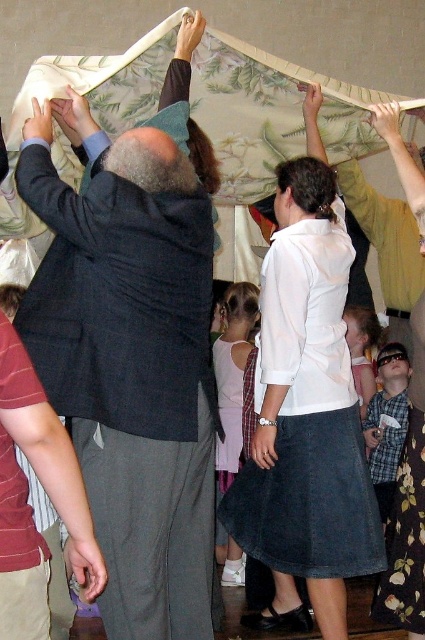
You are a photographer at the event and need to capture a photo of both the white cotton dress at center and the plaid shirt at center. Which one should you focus on first if you want to include both in the frame without moving the camera?

The white cotton dress at center is positioned on the left side of the plaid shirt at center, so you should focus on the white cotton dress at center first to ensure both are included in the frame without moving the camera.

You are standing at the point with coordinates point [224,417] and want to walk to the point with coordinates point [365,417]. Which direction should you move in?

You should move backward because point [224,417] is in front of point [365,417].

You are a photographer at the event and need to capture both the dark gray wool suit at upper left and the maroon striped shirt at lower left in a single frame. Which person should you position closer to the camera to ensure both are fully visible?

You should position the maroon striped shirt at lower left closer to the camera because the dark gray wool suit at upper left is taller, so bringing the shorter maroon striped shirt at lower left forward will balance their sizes in the frame.